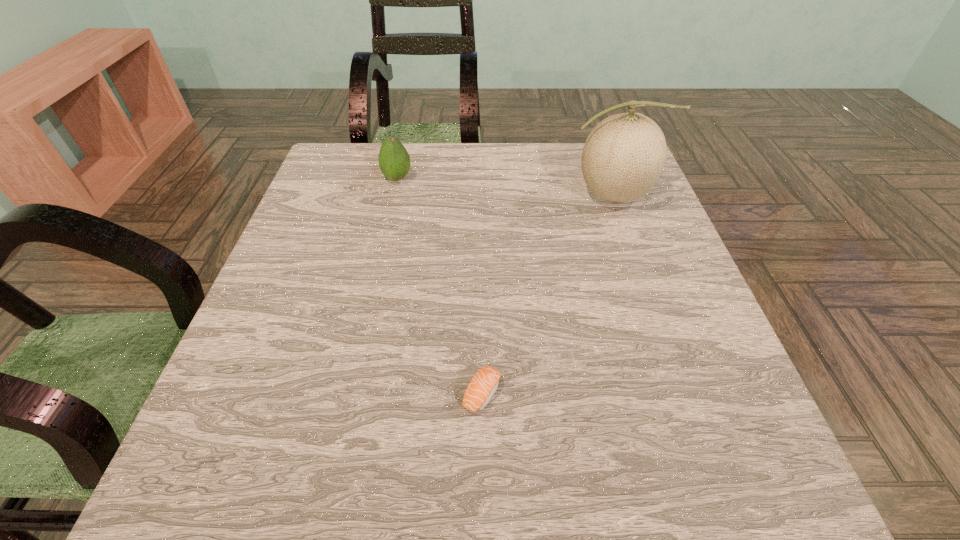
This screenshot has height=540, width=960. In order to click on the tallest object in this screenshot , I will do `click(624, 155)`.

Image resolution: width=960 pixels, height=540 pixels. In order to click on cantaloup in this screenshot , I will do `click(624, 155)`.

The image size is (960, 540). I want to click on the second tallest object, so click(x=394, y=161).

Where is `the leftmost object`? This screenshot has width=960, height=540. the leftmost object is located at coordinates (394, 161).

You are a GUI agent. You are given a task and a screenshot of the screen. Output one action in this format:
    pyautogui.click(x=<x>, y=<y>)
    Task: Click on the sushi
    
    Given the screenshot: What is the action you would take?
    pyautogui.click(x=483, y=385)

You are a GUI agent. You are given a task and a screenshot of the screen. Output one action in this format:
    pyautogui.click(x=<x>, y=<y>)
    Task: Click on the nearest object
    The image size is (960, 540).
    Given the screenshot: What is the action you would take?
    pyautogui.click(x=483, y=385)

Locate an element on the screen. The height and width of the screenshot is (540, 960). free spot located on the left of the cantaloup is located at coordinates (516, 195).

Locate an element on the screen. vacant space located on the front of the avocado is located at coordinates (373, 281).

Identify the location of free space located on the back of the sushi. (481, 290).

I want to click on cantaloup present at the far edge, so click(x=624, y=155).